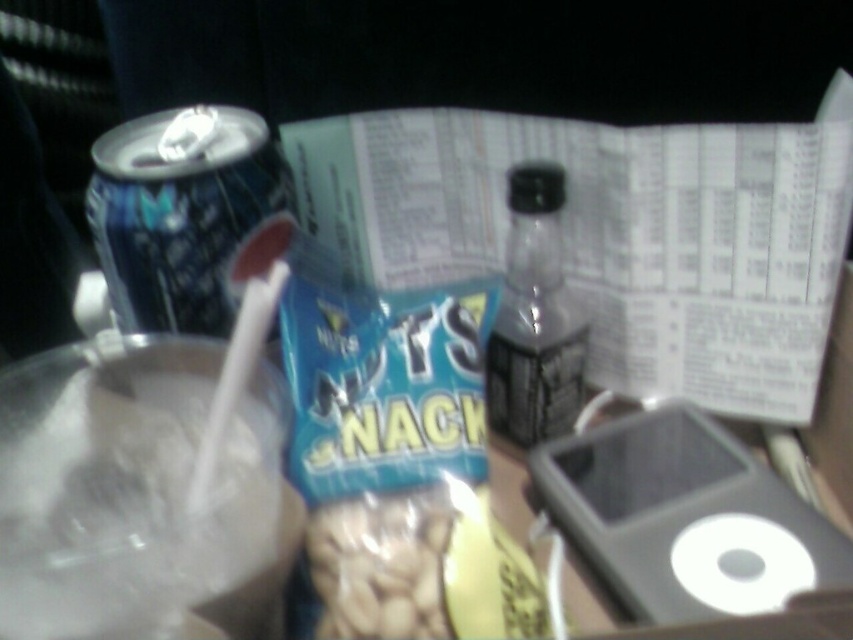
Who is more distant from viewer, (x=186, y=276) or (x=492, y=364)?

Point (x=492, y=364)

Which is more to the left, blue metallic can at left or clear glass bottle at center?

Positioned to the left is blue metallic can at left.

This screenshot has width=853, height=640. What do you see at coordinates (186, 216) in the screenshot?
I see `blue metallic can at left` at bounding box center [186, 216].

This screenshot has width=853, height=640. I want to click on blue metallic can at left, so click(186, 216).

What do you see at coordinates (685, 518) in the screenshot?
I see `black plastic ipod at center` at bounding box center [685, 518].

Is black plastic ipod at center closer to the viewer compared to blue metallic can at left?

Yes, it is.

Is point (550, 444) less distant than point (254, 188)?

No, it is not.

The image size is (853, 640). Identify the location of black plastic ipod at center. (685, 518).

Is black plastic ipod at center bigger than clear glass bottle at center?

Indeed, black plastic ipod at center has a larger size compared to clear glass bottle at center.

You are a GUI agent. You are given a task and a screenshot of the screen. Output one action in this format:
    pyautogui.click(x=<x>, y=<y>)
    Task: Click on the black plastic ipod at center
    Image resolution: width=853 pixels, height=640 pixels.
    Given the screenshot: What is the action you would take?
    pyautogui.click(x=685, y=518)